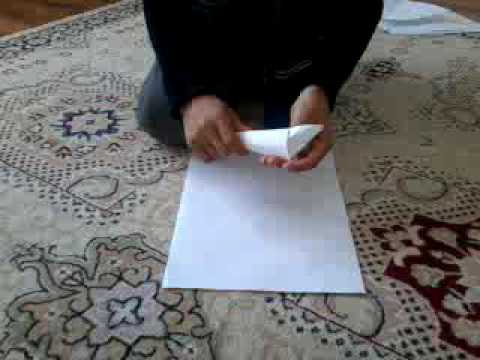
Where is `floor`? The height and width of the screenshot is (360, 480). floor is located at coordinates (63, 8).